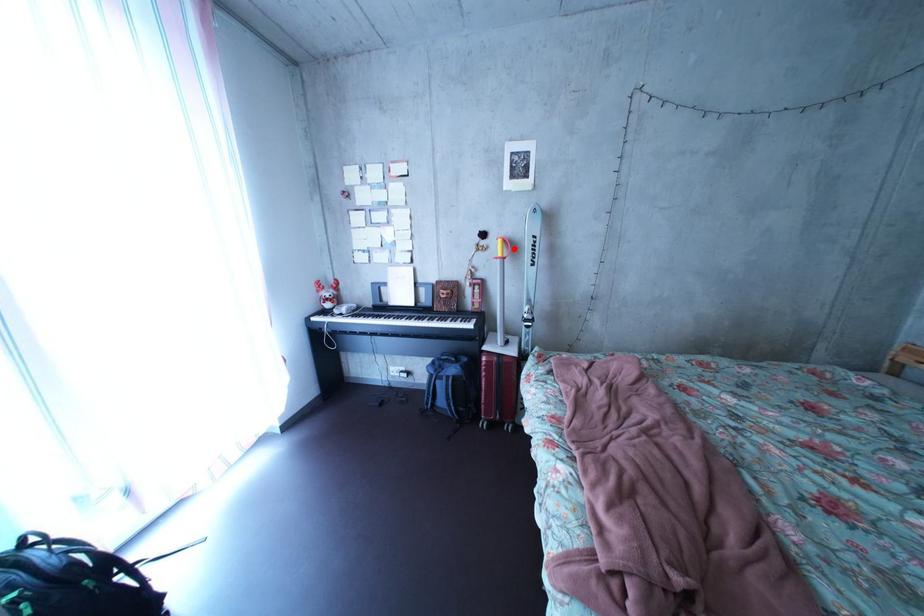
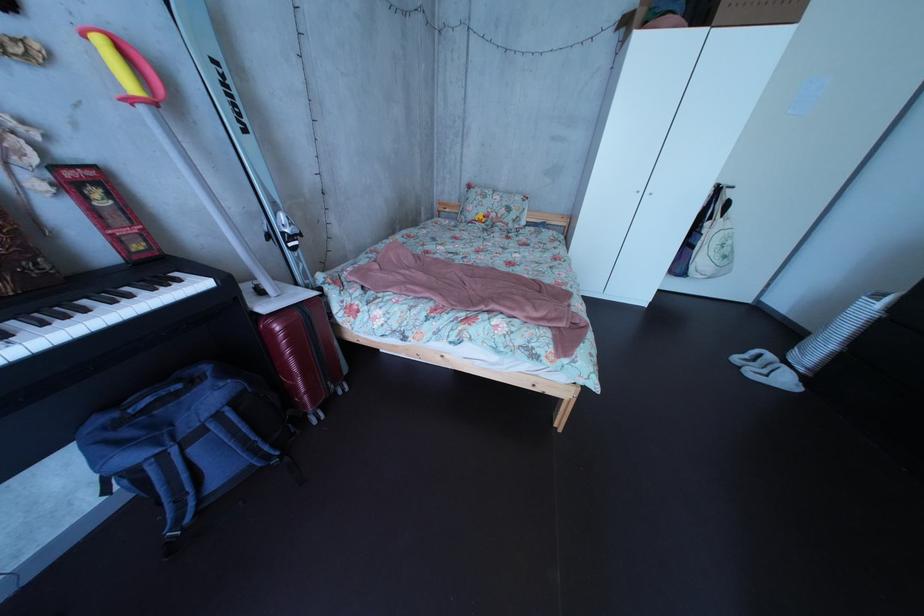
Question: I am providing you with two images of the same scene from different viewpoints. In image1, a red point is highlighted. Considering the same 3D point in image2, which of the following is correct?

Choices:
 (A) It is closer
 (B) It is farther

Answer: (B)